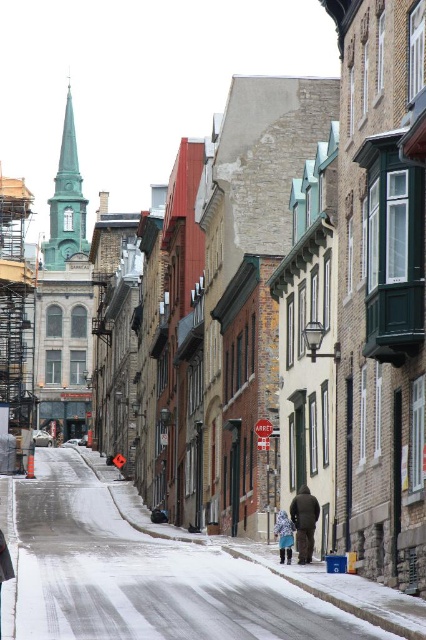
Does dark brown leather jacket at center have a lesser width compared to blue denim jacket at lower center?

Indeed, dark brown leather jacket at center has a lesser width compared to blue denim jacket at lower center.

Is point (308, 492) closer to camera compared to point (281, 516)?

No, it is behind (281, 516).

In order to click on dark brown leather jacket at center in this screenshot , I will do `click(304, 522)`.

Can you confirm if white snow at center is positioned below blue denim jacket at lower center?

Correct, white snow at center is located below blue denim jacket at lower center.

How far apart are white snow at center and blue denim jacket at lower center?

white snow at center is 22.40 meters away from blue denim jacket at lower center.

Find the location of a particular element. white snow at center is located at coordinates (143, 573).

Find the location of `white snow at center`. white snow at center is located at coordinates (143, 573).

Can you confirm if green glass spire at upper left is positioned below dark brown leather jacket at center?

Actually, green glass spire at upper left is above dark brown leather jacket at center.

Can you confirm if green glass spire at upper left is positioned to the right of dark brown leather jacket at center?

No, green glass spire at upper left is not to the right of dark brown leather jacket at center.

Where is `green glass spire at upper left`? Image resolution: width=426 pixels, height=640 pixels. green glass spire at upper left is located at coordinates (66, 202).